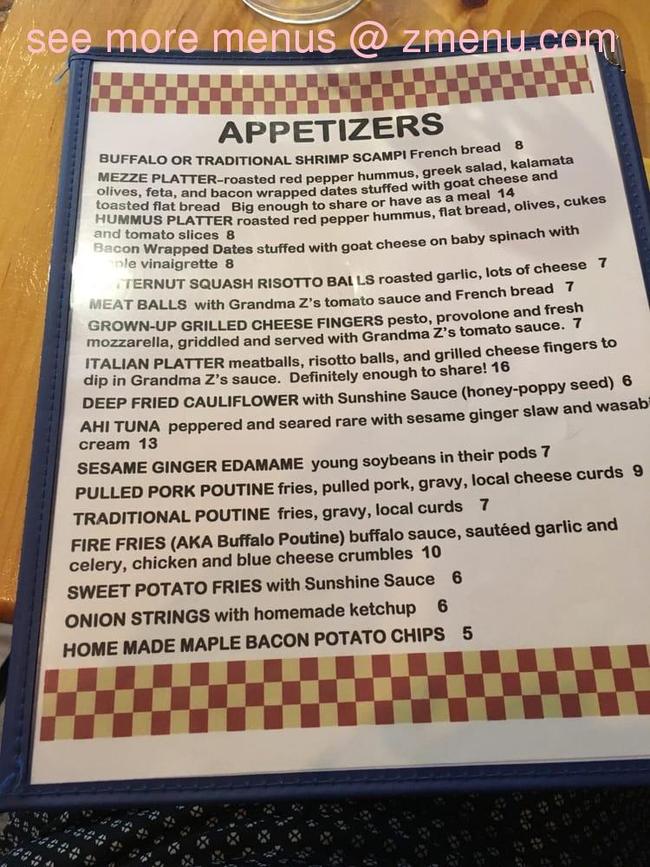
Image resolution: width=650 pixels, height=867 pixels. Identify the location of knot in wood table top. (474, 3).